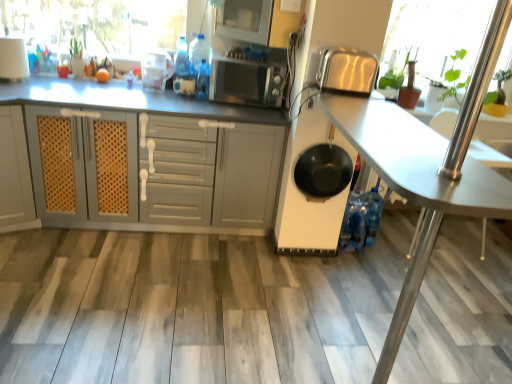
In order to click on free point below metallic silver table at center (from a real-world perspective) in this screenshot , I will do (x=330, y=333).